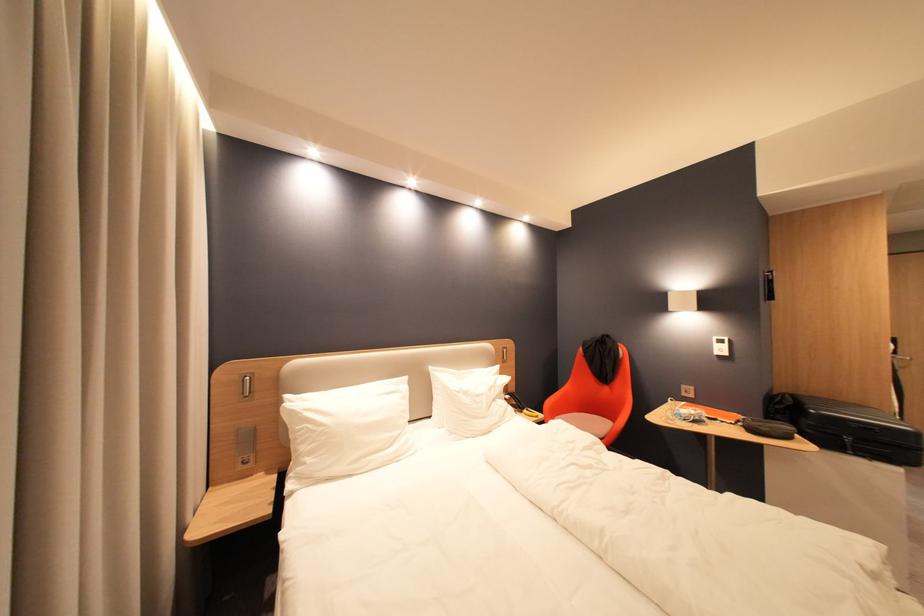
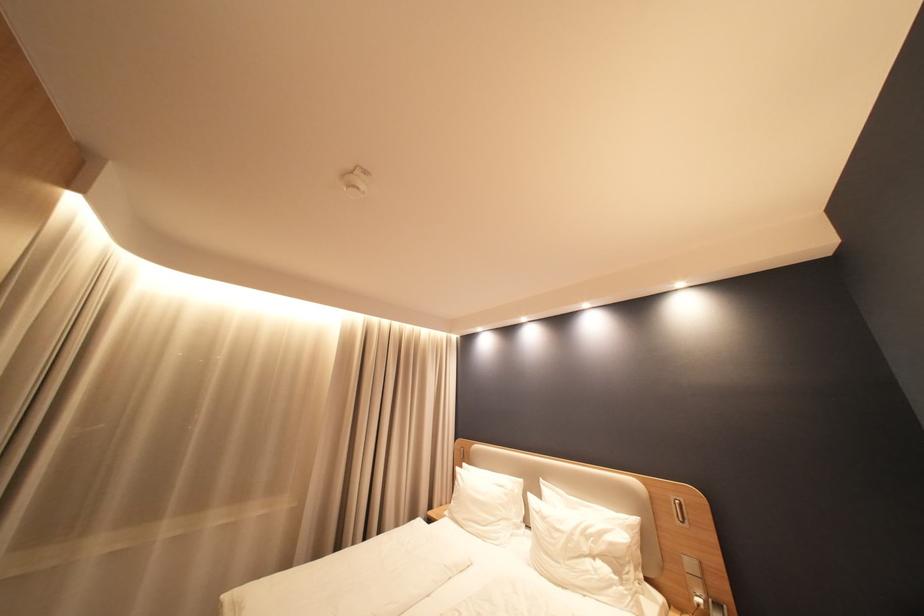
The point at (468, 391) is marked in the first image. Where is the corresponding point in the second image?

(546, 511)